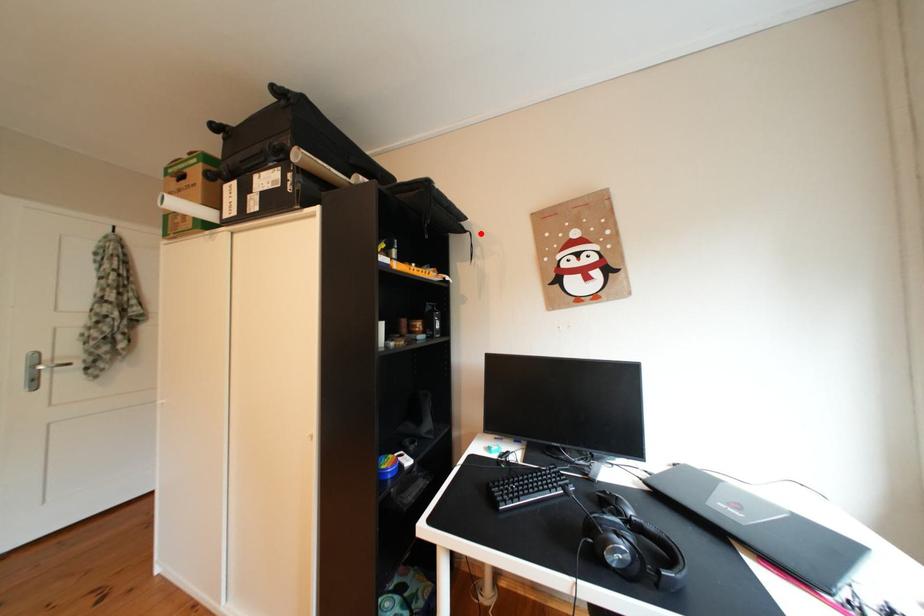
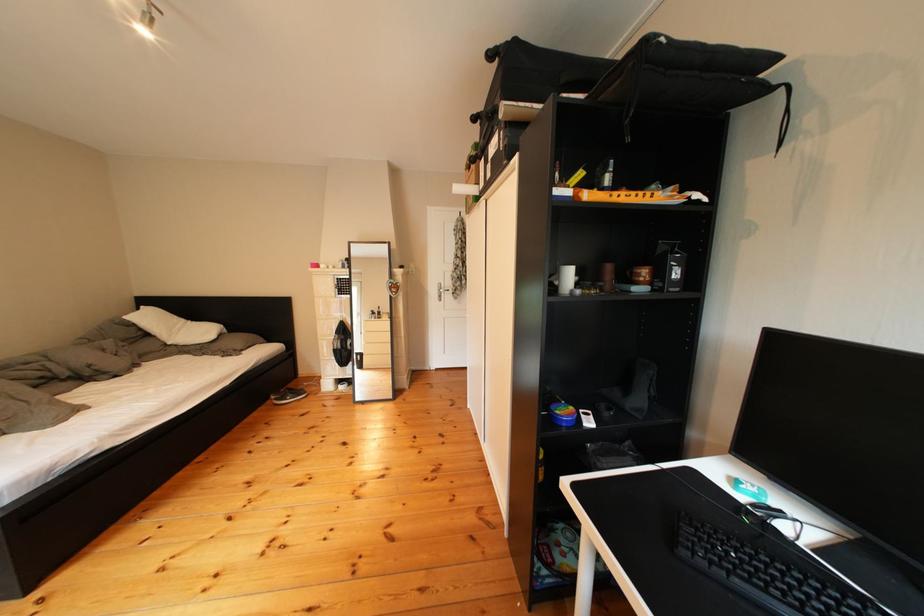
Find the pixel in the second image that matches the highlighted location in the first image.

(789, 87)